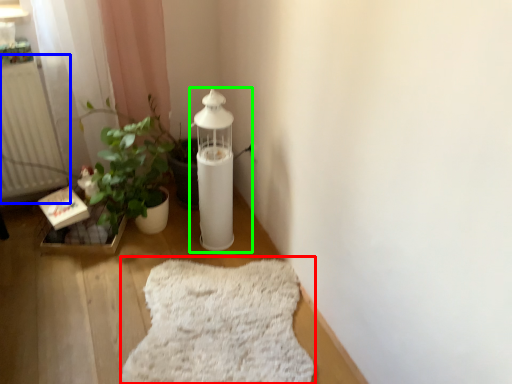
Question: Based on their relative distances, which object is nearer to blanket (highlighted by a red box)? Choose from radiator (highlighted by a blue box) and oil lamp (highlighted by a green box).

Choices:
 (A) radiator
 (B) oil lamp

Answer: (B)